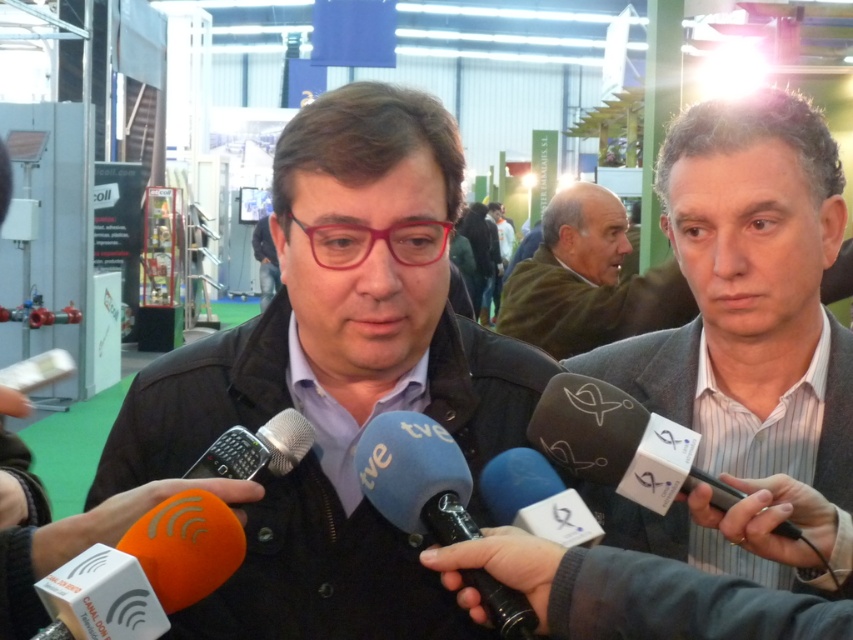
Question: Which point is farther from the camera taking this photo?

Choices:
 (A) (265, 428)
 (B) (587, 209)
 (C) (724, 240)

Answer: (B)

Question: Is gray striped shirt at right thinner than blue fabric microphone at center?

Choices:
 (A) yes
 (B) no

Answer: (B)

Question: Which of the following is the closest to the observer?

Choices:
 (A) blue fabric microphone at center
 (B) gray striped shirt at right
 (C) white plastic microphone at center
 (D) black matte jacket at center

Answer: (A)

Question: Can you confirm if gray striped shirt at right is bigger than blue fabric microphone at center?

Choices:
 (A) yes
 (B) no

Answer: (A)

Question: Is the position of gray wool sweater at center more distant than that of black plastic microphone at center?

Choices:
 (A) no
 (B) yes

Answer: (B)

Question: Among these points, which one is farthest from the camera?

Choices:
 (A) (614, 288)
 (B) (268, 515)
 (C) (224, 435)

Answer: (A)